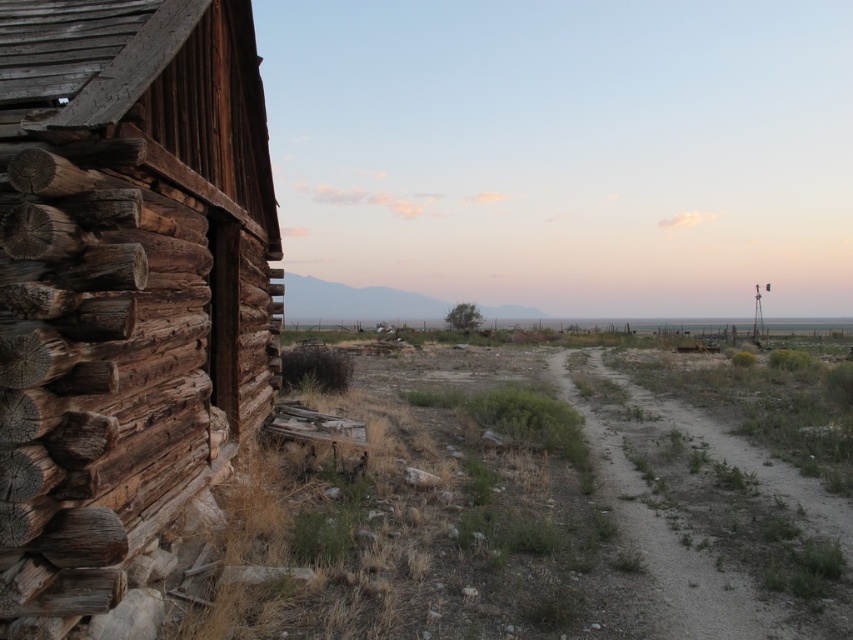
You are standing at the log cabin on the left and want to walk towards the windmill in the distance. Which point, point [41,564] or point [589,403], is closer to your path?

Point [41,564] is closer to your path because it is in front of point [589,403], meaning it lies along the direction you are facing towards the windmill.